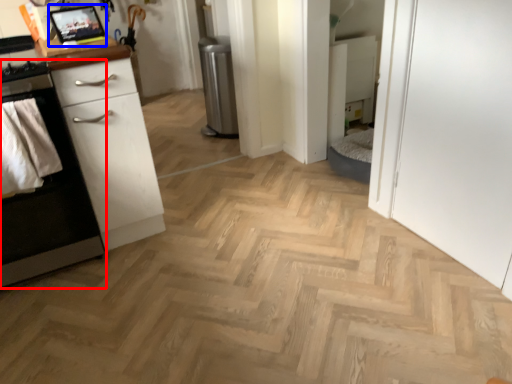
Question: Among these objects, which one is nearest to the camera, cabinetry (highlighted by a red box) or appliance (highlighted by a blue box)?

Choices:
 (A) cabinetry
 (B) appliance

Answer: (A)